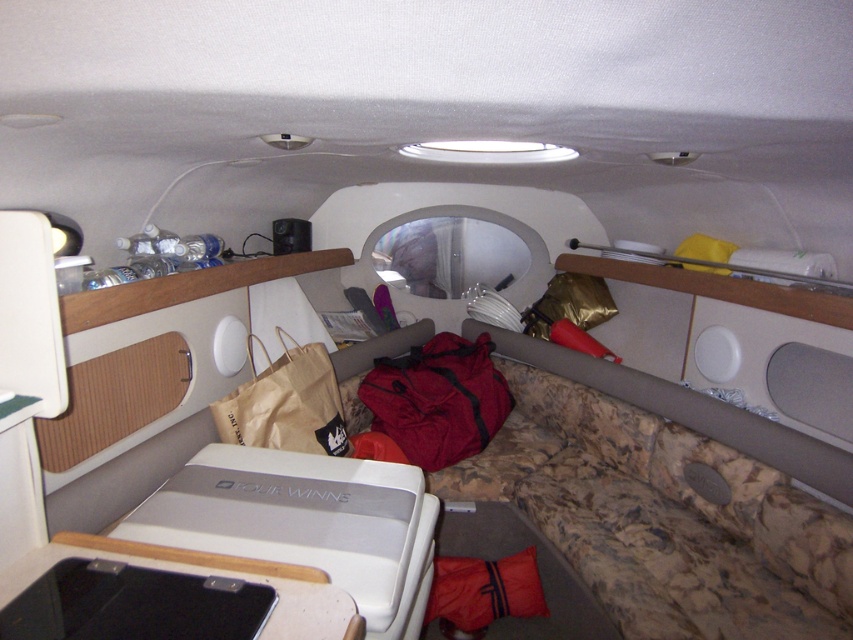
Is red fabric bag at center in front of brown paper bag at center?

No.

Who is more forward, (469, 436) or (318, 378)?

Point (318, 378) is more forward.

Image resolution: width=853 pixels, height=640 pixels. What are the coordinates of `red fabric bag at center` in the screenshot? It's located at (437, 400).